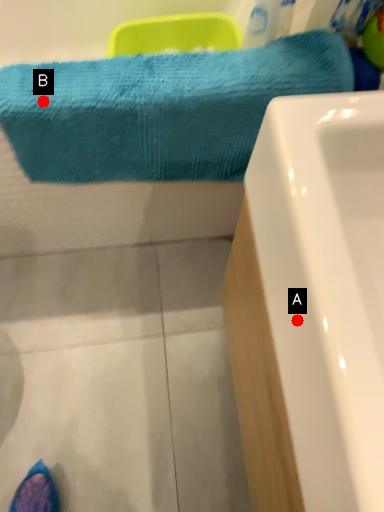
Question: Two points are circled on the image, labeled by A and B beside each circle. Which point is farther to the camera?

Choices:
 (A) A is further
 (B) B is further

Answer: (B)